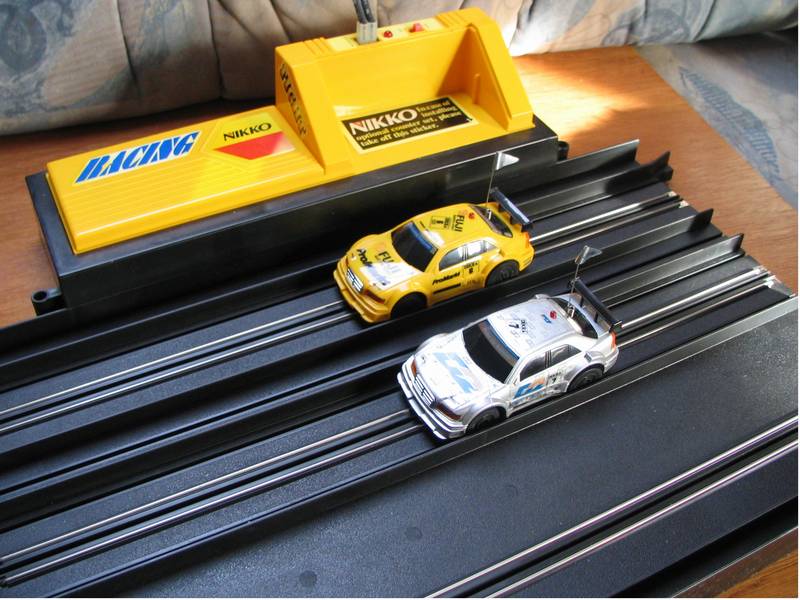
Locate an element on the screen. Image resolution: width=800 pixels, height=600 pixels. back windows is located at coordinates (580, 315), (498, 223).